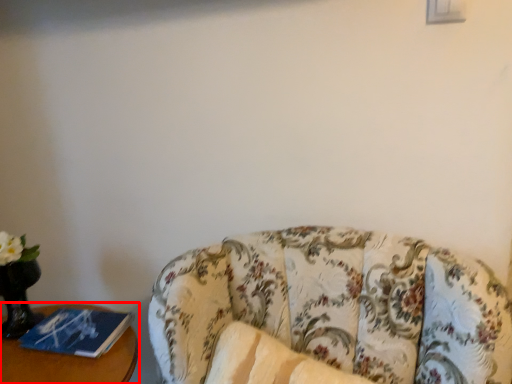
Question: Observing the image, what is the correct spatial positioning of furniture (annotated by the red box) in reference to studio couch?

Choices:
 (A) left
 (B) right

Answer: (A)